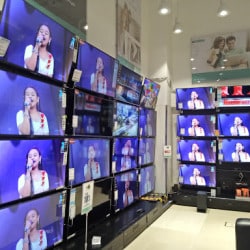
Identify the location of hanging light. The width and height of the screenshot is (250, 250). point(162,8), point(177,29), point(221,11).